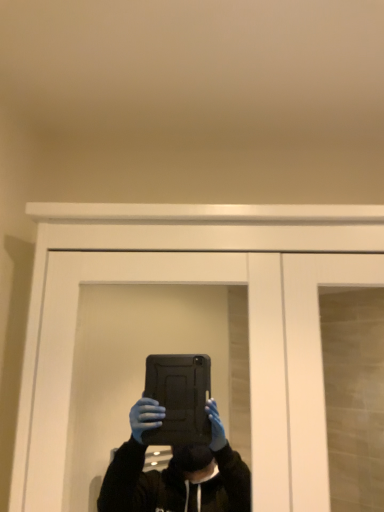
Image resolution: width=384 pixels, height=512 pixels. Describe the element at coordinates (198, 282) in the screenshot. I see `black matte tablet at center` at that location.

Locate an element on the screen. black matte tablet at center is located at coordinates (198, 282).

I want to click on black matte tablet at center, so click(x=198, y=282).